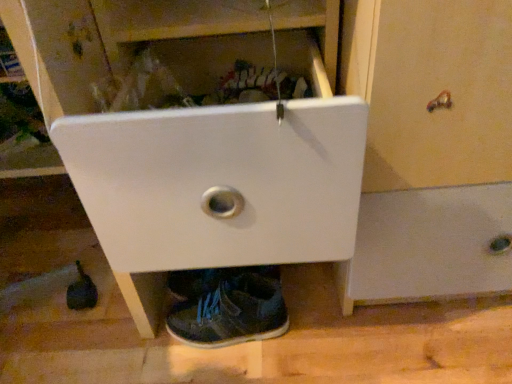
The width and height of the screenshot is (512, 384). I want to click on free space in front of dark blue canvas shoe at lower center, so click(x=233, y=364).